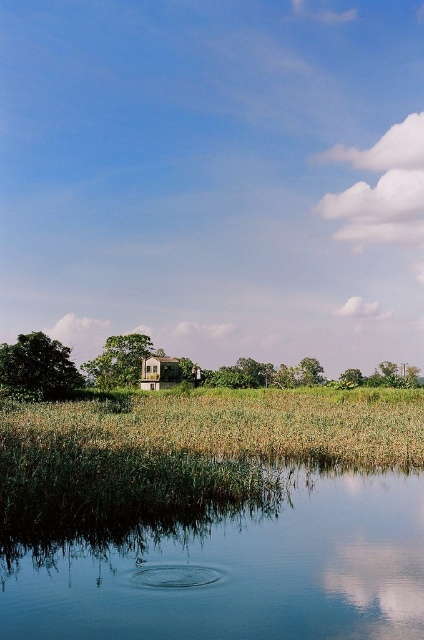
You are standing in the middle of the green grassy field at center and want to get to the transparent glass water at lower center. Which direction should you move to reach the water?

The transparent glass water at lower center is above the green grassy field at center, so you should move upwards to reach the water.